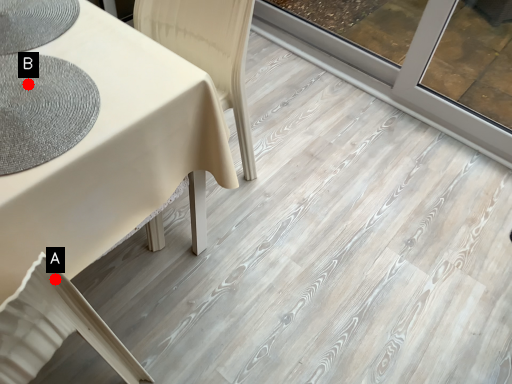
Question: Two points are circled on the image, labeled by A and B beside each circle. Which of the following is the farthest from the observer?

Choices:
 (A) A is further
 (B) B is further

Answer: (B)